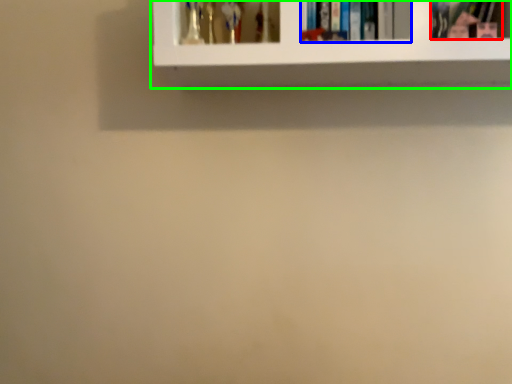
Question: Which object is the closest to the book (highlighted by a red box)? Choose among these: book (highlighted by a blue box) or shelf (highlighted by a green box).

Choices:
 (A) book
 (B) shelf

Answer: (A)